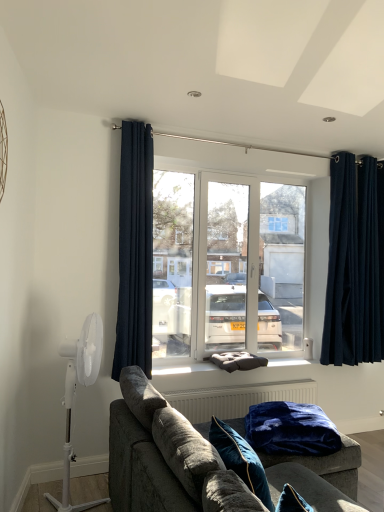
Question: Is navy blue velvet curtains at right, arranged as the second curtain when viewed from the left, further to camera compared to dark blue textured curtain at center, which ranks as the first curtain in left-to-right order?

Choices:
 (A) yes
 (B) no

Answer: (A)

Question: Is dark blue textured curtain at center, which ranks as the first curtain in left-to-right order, at the back of navy blue velvet curtains at right, arranged as the second curtain when viewed from the left?

Choices:
 (A) no
 (B) yes

Answer: (A)

Question: Is navy blue velvet curtains at right, arranged as the second curtain when viewed from the left, located outside dark blue textured curtain at center, which appears as the first curtain when viewed from the front?

Choices:
 (A) yes
 (B) no

Answer: (A)

Question: Is navy blue velvet curtains at right, arranged as the second curtain when viewed from the left, oriented towards dark blue textured curtain at center, which appears as the 2th curtain when viewed from the back?

Choices:
 (A) no
 (B) yes

Answer: (A)

Question: Can you confirm if navy blue velvet curtains at right, the 2th curtain from the front, is positioned to the right of dark blue textured curtain at center, which appears as the 2th curtain when viewed from the back?

Choices:
 (A) no
 (B) yes

Answer: (B)

Question: Considering the relative sizes of navy blue velvet curtains at right, arranged as the second curtain when viewed from the left, and dark blue textured curtain at center, which appears as the first curtain when viewed from the front, in the image provided, is navy blue velvet curtains at right, arranged as the second curtain when viewed from the left, thinner than dark blue textured curtain at center, which appears as the first curtain when viewed from the front,?

Choices:
 (A) yes
 (B) no

Answer: (A)

Question: Is dark blue textured curtain at center, which appears as the 2th curtain when viewed from the back, aimed at velvet blue pillow at lower center, placed as the 2th pillow when sorted from back to front?

Choices:
 (A) yes
 (B) no

Answer: (A)

Question: Is dark blue textured curtain at center, which ranks as the first curtain in left-to-right order, smaller than velvet blue pillow at lower center, arranged as the first pillow when viewed from the front?

Choices:
 (A) yes
 (B) no

Answer: (B)

Question: Can you confirm if dark blue textured curtain at center, which ranks as the first curtain in left-to-right order, is positioned to the right of velvet blue pillow at lower center, arranged as the first pillow when viewed from the front?

Choices:
 (A) no
 (B) yes

Answer: (A)

Question: Considering the relative sizes of dark blue textured curtain at center, which ranks as the first curtain in left-to-right order, and velvet blue pillow at lower center, arranged as the first pillow when viewed from the front, in the image provided, is dark blue textured curtain at center, which ranks as the first curtain in left-to-right order, shorter than velvet blue pillow at lower center, arranged as the first pillow when viewed from the front,?

Choices:
 (A) yes
 (B) no

Answer: (B)

Question: From a real-world perspective, is dark blue textured curtain at center, which appears as the 2th curtain when viewed from the back, under velvet blue pillow at lower center, placed as the 2th pillow when sorted from back to front?

Choices:
 (A) yes
 (B) no

Answer: (B)

Question: Would you consider dark blue textured curtain at center, acting as the 2th curtain starting from the right, to be distant from velvet blue pillow at lower center, arranged as the first pillow when viewed from the front?

Choices:
 (A) yes
 (B) no

Answer: (A)

Question: Considering the relative sizes of white plastic mechanical fan at left and velvet blue blanket at lower center in the image provided, is white plastic mechanical fan at left thinner than velvet blue blanket at lower center?

Choices:
 (A) no
 (B) yes

Answer: (B)